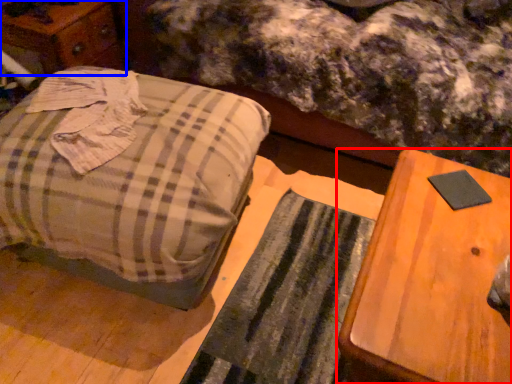
Question: Which point is closer to the camera, table (highlighted by a red box) or dresser (highlighted by a blue box)?

Choices:
 (A) table
 (B) dresser

Answer: (A)